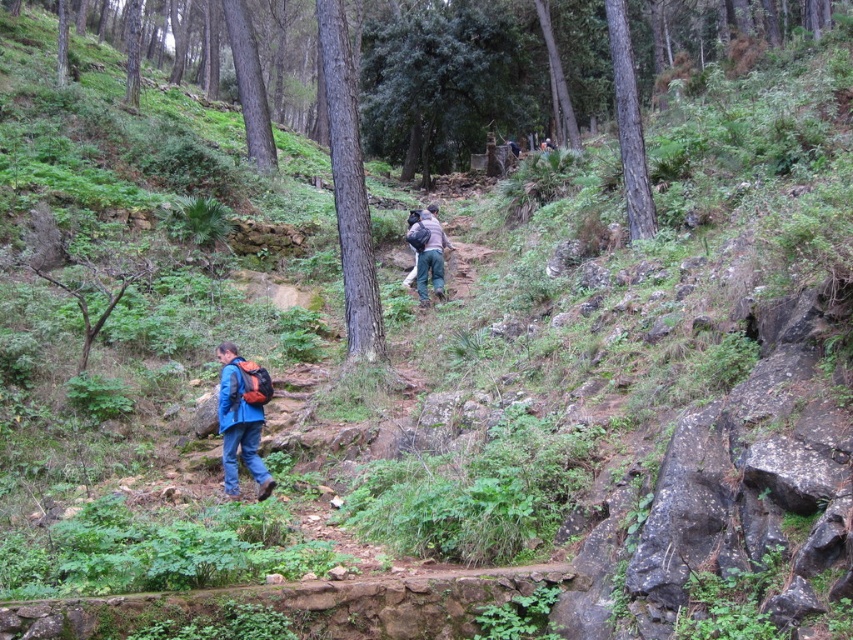
You are a hiker trying to locate your backpack. You see a matte blue jacket at lower left and a dark brown backpack at center. Which object is closer to you?

The matte blue jacket at lower left is closer to you because it is in front of the dark brown backpack at center.

Based on the photo, you are a hiker who wants to place both the matte blue jacket at lower left and the dark brown backpack at center on the ground. Given the space constraints, which item can you place first without moving the other?

The matte blue jacket at lower left occupies less space than the dark brown backpack at center, so you can place the matte blue jacket at lower left first without needing to move the backpack.